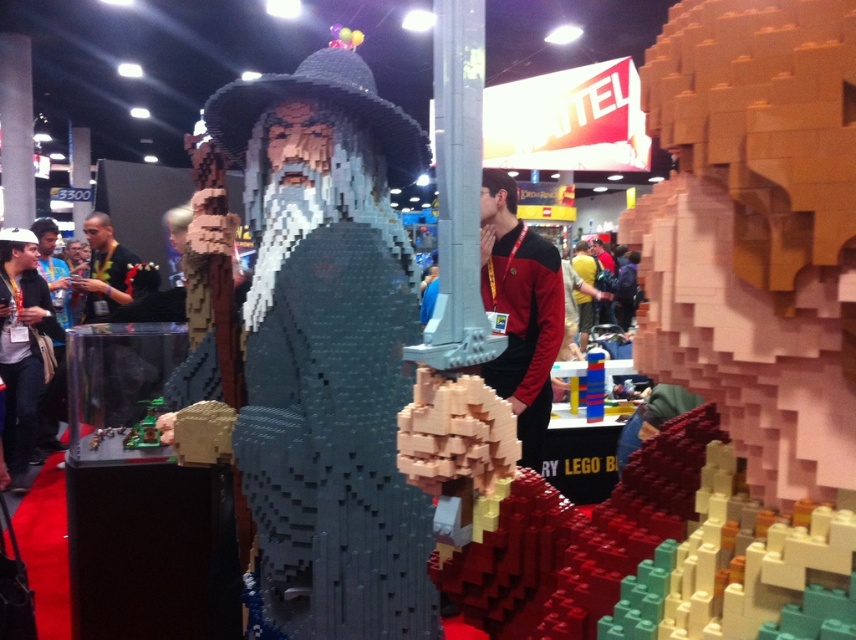
You are a photographer at the LEGO exhibition. You need to capture a photo where the black fabric shirt at left and the metallic green toy at center are both visible. Considering their heights, which object will appear larger in the photo?

The black fabric shirt at left is taller than the metallic green toy at center, so it will appear larger in the photo.

You are at a LEGO exhibition and want to take a photo of both the black fabric shirt at left and the metallic green toy at center. What is the minimum distance you need to move backward to ensure both objects are in frame?

The black fabric shirt at left is 8.26 feet away from the metallic green toy at center. To capture both in a single frame, you should move back at least half of that distance, which is approximately 4.13 feet, to ensure both objects are within the camera view.

You are a photographer at the LEGO exhibition. You need to capture a photo that includes both the black fabric shirt at left and the metallic green toy at center. Which object should you focus on first if you want to ensure both are in frame without moving the camera?

The black fabric shirt at left is larger in size than the metallic green toy at center, so you should focus on the metallic green toy at center first to ensure both fit within the frame.